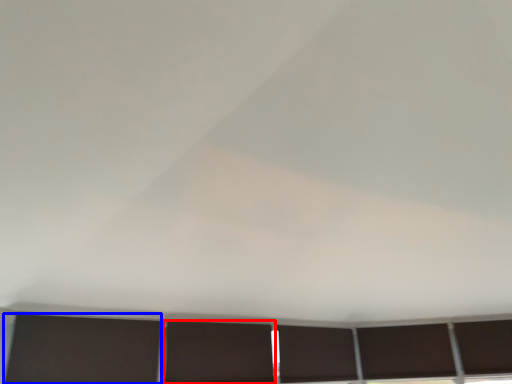
Question: Which point is further to the camera, shutter (highlighted by a red box) or shutter (highlighted by a blue box)?

Choices:
 (A) shutter
 (B) shutter

Answer: (A)